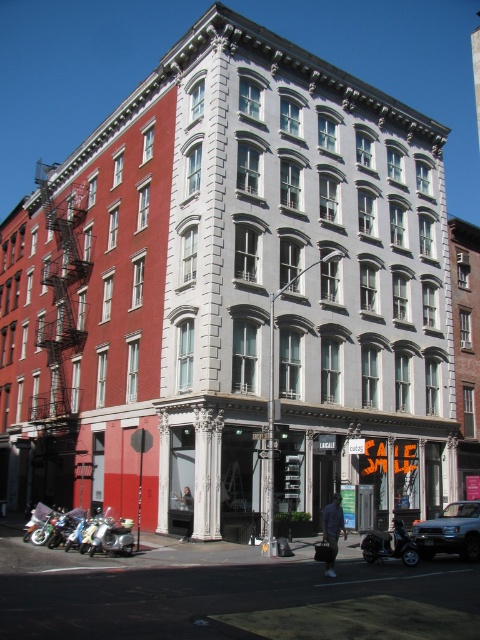
You are a delivery driver who needs to park your vehicle in the parking lot behind this building. The parking spot you want to use has a height restriction of 1.8 meters. You have two options for parking your vehicle here between the metallic silver suv at center and the shiny chrome motorcycle at lower right. Which vehicle should you choose to park without exceeding the height limit?

The shiny chrome motorcycle at lower right is shorter than the metallic silver suv at center. Since the parking spot has a height restriction of 1.8 meters, you should choose the shiny chrome motorcycle at lower right to park without exceeding the height limit.

You are standing at a crosswalk 30 meters away from the building. You see a metallic silver suv at center. Can you safely cross the street without the suv moving? Please explain your reasoning.

The metallic silver suv at center is 34.61 meters away from the viewer. Since you are only 30 meters away from the building, the suv is actually behind you, meaning it cannot pose a threat as you cross the street.

You are a delivery person needing to park your vehicle in this area. The parking spot is directly in front of the shiny chrome motorcycle at lower right. Can you safely park your metallic silver suv at center there without blocking the motorcycle?

The metallic silver suv at center is to the right of the shiny chrome motorcycle at lower right, so parking the SUV in the spot directly in front of the motorcycle would place the SUV to the right of the motorcycle, not blocking it. Therefore, it is safe to park there.